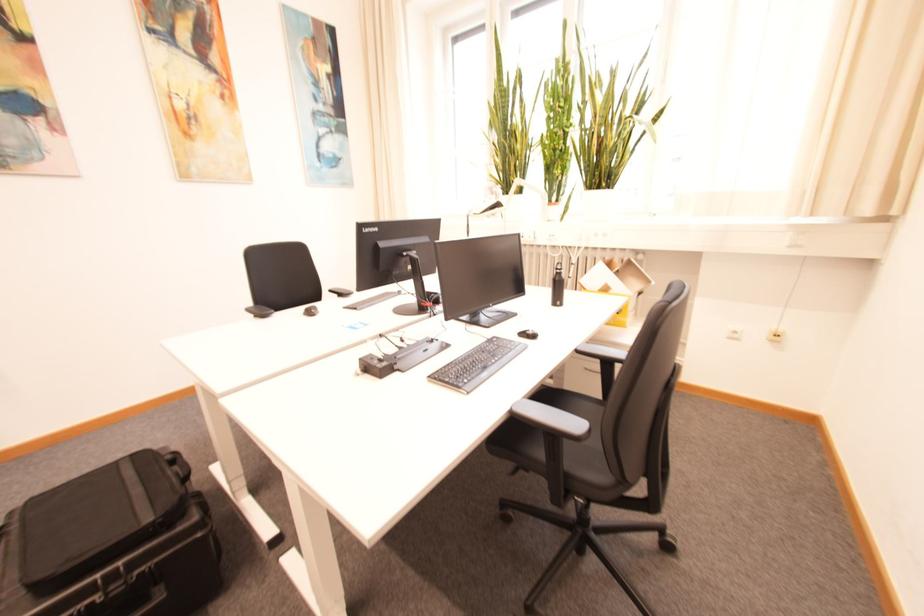
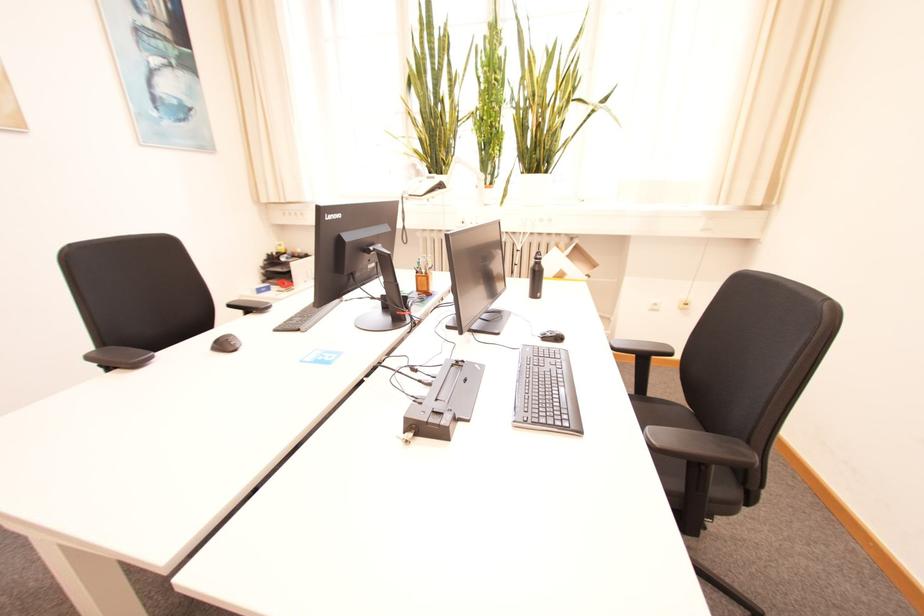
The point at (x=530, y=334) is marked in the first image. Where is the corresponding point in the second image?

(551, 338)